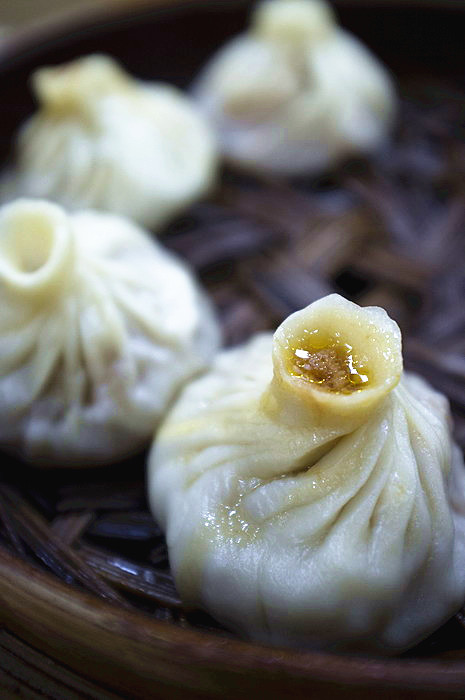
I want to click on bamboo steamer, so click(57, 661).